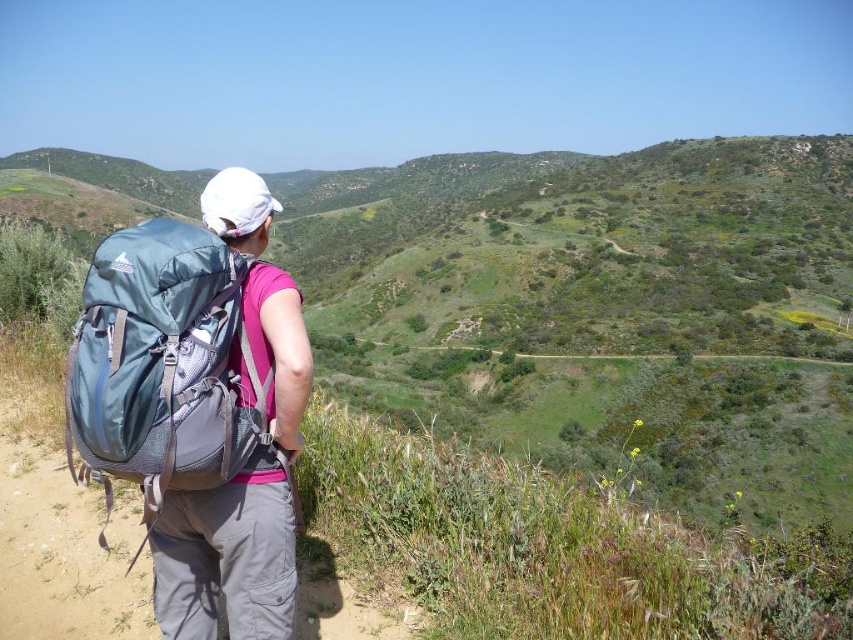
Question: Which point appears closest to the camera in this image?

Choices:
 (A) (129, 262)
 (B) (271, 474)

Answer: (A)

Question: Can you confirm if teal fabric backpack at left is positioned below matte blue backpack at left?

Choices:
 (A) yes
 (B) no

Answer: (A)

Question: Which object is farther from the camera taking this photo?

Choices:
 (A) matte blue backpack at left
 (B) teal fabric backpack at left

Answer: (A)

Question: From the image, what is the correct spatial relationship of teal fabric backpack at left in relation to matte blue backpack at left?

Choices:
 (A) above
 (B) below

Answer: (B)

Question: Is teal fabric backpack at left further to the viewer compared to matte blue backpack at left?

Choices:
 (A) no
 (B) yes

Answer: (A)